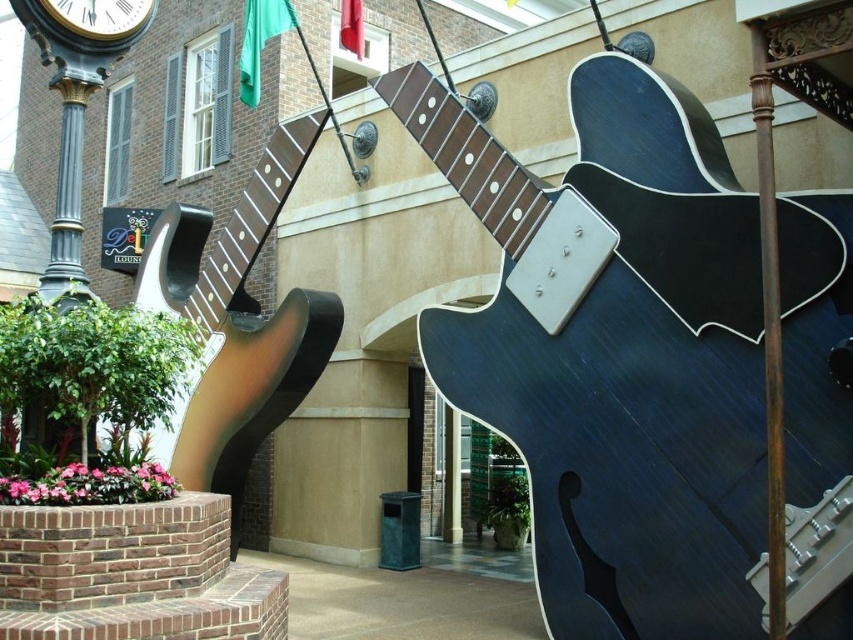
Between wooden guitar at center and metallic gold clock at upper left, which one has more height?

With more height is wooden guitar at center.

Is point (335, 321) behind point (115, 12)?

That is True.

The height and width of the screenshot is (640, 853). I want to click on wooden guitar at center, so click(236, 321).

Based on the photo, who is positioned more to the right, glossy dark blue guitar at center or wooden guitar at center?

Positioned to the right is glossy dark blue guitar at center.

Who is more distant from viewer, (540, 214) or (248, 230)?

Point (248, 230)

Which is behind, point (473, 396) or point (209, 296)?

Positioned behind is point (209, 296).

The height and width of the screenshot is (640, 853). I want to click on glossy dark blue guitar at center, so click(x=614, y=353).

Is glossy dark blue guitar at center above metallic gold clock at upper left?

Incorrect, glossy dark blue guitar at center is not positioned above metallic gold clock at upper left.

Does glossy dark blue guitar at center have a lesser height compared to metallic gold clock at upper left?

No, glossy dark blue guitar at center is not shorter than metallic gold clock at upper left.

Which is in front, point (618, 88) or point (71, 8)?

Point (71, 8) is more forward.

You are a GUI agent. You are given a task and a screenshot of the screen. Output one action in this format:
    pyautogui.click(x=<x>, y=<y>)
    Task: Click on the glossy dark blue guitar at center
    Image resolution: width=853 pixels, height=640 pixels.
    Given the screenshot: What is the action you would take?
    pyautogui.click(x=614, y=353)